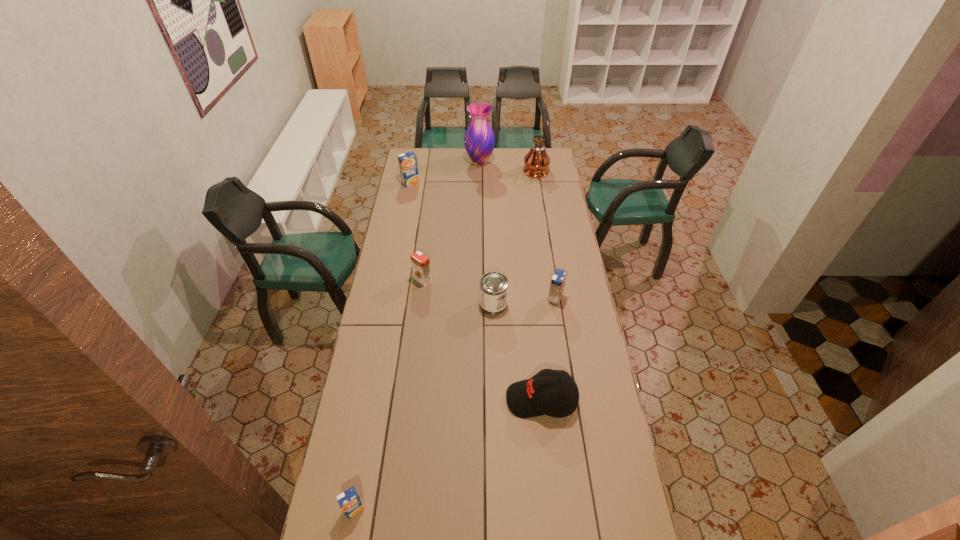
At what (x,y) coordinates should I click in order to perform the action: click on free point between the oil lamp and the nearest orange_juice. Please return your answer as a coordinate pair (x, y). This screenshot has width=960, height=540. Looking at the image, I should click on (445, 341).

Identify which object is located as the third nearest to the baseball cap. Please provide its 2D coordinates. Your answer should be formatted as a tuple, i.e. [(x, y)], where the tuple contains the x and y coordinates of a point satisfying the conditions above.

[(349, 501)]

Where is `the seventh closest object to the can`? The height and width of the screenshot is (540, 960). the seventh closest object to the can is located at coordinates (479, 140).

This screenshot has width=960, height=540. In order to click on orange_juice that is the third closest to the oil lamp in this screenshot , I will do `click(420, 263)`.

You are a GUI agent. You are given a task and a screenshot of the screen. Output one action in this format:
    pyautogui.click(x=<x>, y=<y>)
    Task: Click on the orange_juice that is the second closest one to the rightmost blue orange_juice
    The image size is (960, 540).
    Given the screenshot: What is the action you would take?
    pyautogui.click(x=349, y=501)

Identify which blue orange_juice is the third closest to the oil lamp. Please provide its 2D coordinates. Your answer should be formatted as a tuple, i.e. [(x, y)], where the tuple contains the x and y coordinates of a point satisfying the conditions above.

[(349, 501)]

Where is `blue orange_juice that is the closest to the vase`? Image resolution: width=960 pixels, height=540 pixels. blue orange_juice that is the closest to the vase is located at coordinates (408, 166).